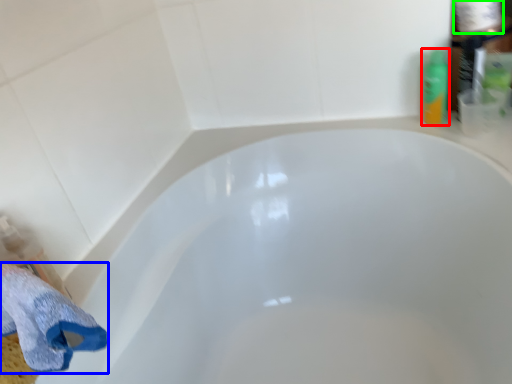
Question: Which is farther away from toiletry (highlighted by a red box)? bath towel (highlighted by a blue box) or toilet paper (highlighted by a green box)?

Choices:
 (A) bath towel
 (B) toilet paper

Answer: (A)